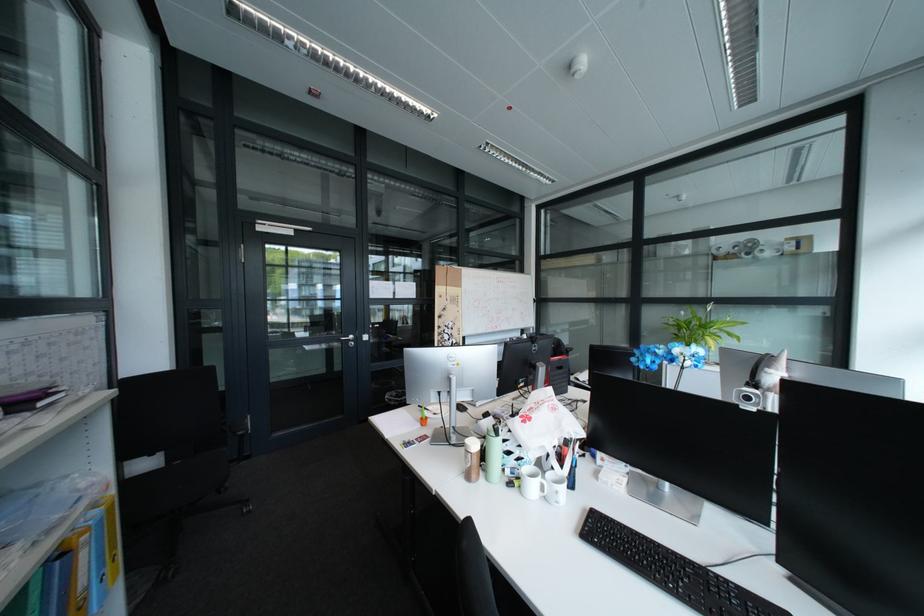
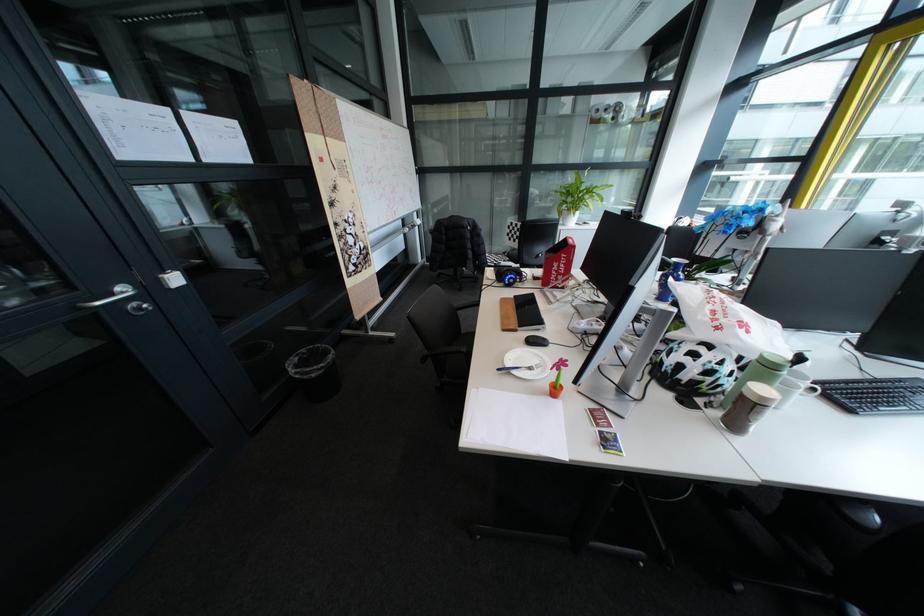
Where in the second image is the point corresponding to point 414,391 from the first image?

(317, 351)